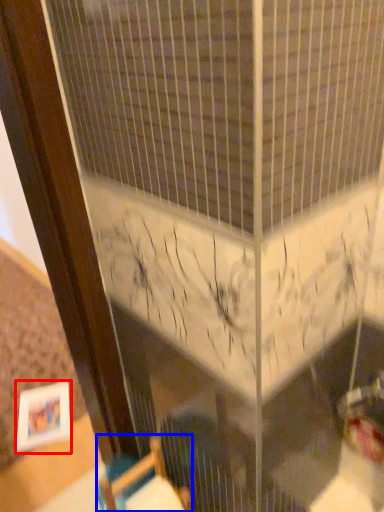
Question: Which of the following is the closest to the observer, picture frame (highlighted by a red box) or furniture (highlighted by a blue box)?

Choices:
 (A) picture frame
 (B) furniture

Answer: (B)